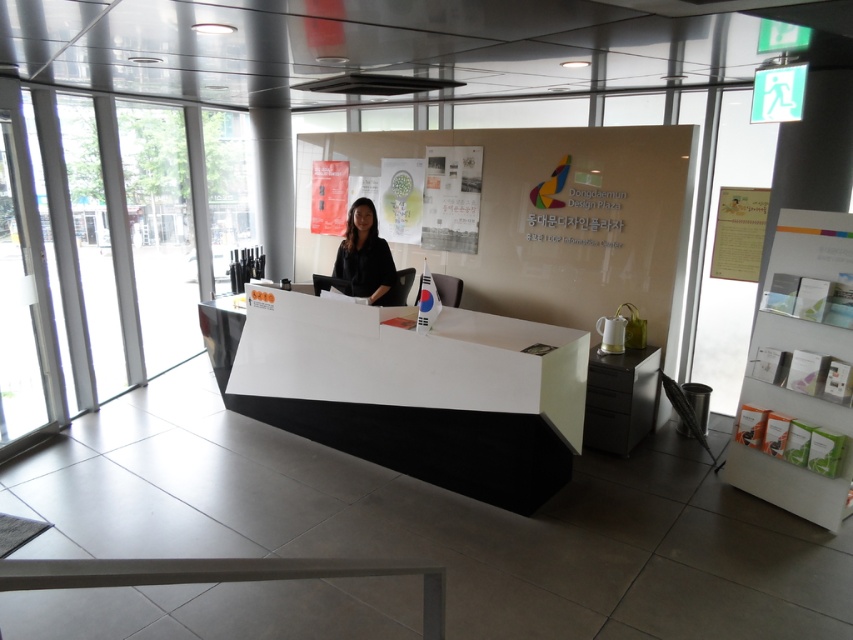
Question: Among these points, which one is farthest from the camera?

Choices:
 (A) (357, 225)
 (B) (447, 333)

Answer: (A)

Question: Among these points, which one is farthest from the camera?

Choices:
 (A) (457, 472)
 (B) (363, 248)

Answer: (B)

Question: Observing the image, what is the correct spatial positioning of white glossy reception desk at center in reference to black matte shirt at center?

Choices:
 (A) left
 (B) right

Answer: (B)

Question: In this image, where is white glossy reception desk at center located relative to black matte shirt at center?

Choices:
 (A) below
 (B) above

Answer: (A)

Question: Can you confirm if white glossy reception desk at center is positioned below black matte shirt at center?

Choices:
 (A) yes
 (B) no

Answer: (A)